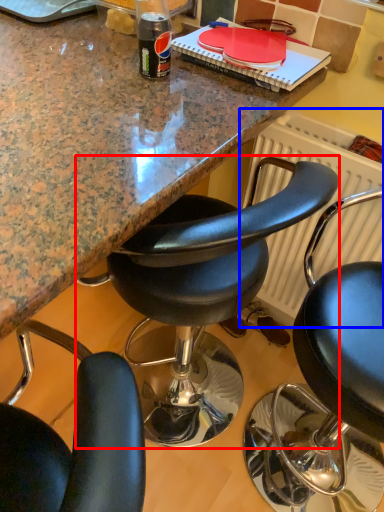
Question: Which object is further to the camera taking this photo, chair (highlighted by a red box) or radiator (highlighted by a blue box)?

Choices:
 (A) chair
 (B) radiator

Answer: (B)